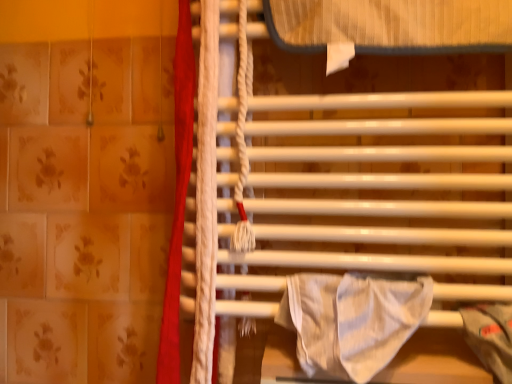
Question: Considering the relative sizes of red fabric curtain at left and white glossy towel rack at center in the image provided, is red fabric curtain at left smaller than white glossy towel rack at center?

Choices:
 (A) no
 (B) yes

Answer: (B)

Question: Can you confirm if red fabric curtain at left is shorter than white glossy towel rack at center?

Choices:
 (A) yes
 (B) no

Answer: (B)

Question: From a real-world perspective, is red fabric curtain at left physically above white glossy towel rack at center?

Choices:
 (A) no
 (B) yes

Answer: (A)

Question: Would you say red fabric curtain at left is a long distance from white glossy towel rack at center?

Choices:
 (A) yes
 (B) no

Answer: (B)

Question: From the image's perspective, is red fabric curtain at left over white glossy towel rack at center?

Choices:
 (A) yes
 (B) no

Answer: (B)

Question: Looking at the image, does white striped fabric at center seem bigger or smaller compared to red fabric curtain at left?

Choices:
 (A) big
 (B) small

Answer: (B)

Question: From the image's perspective, is white striped fabric at center above or below red fabric curtain at left?

Choices:
 (A) above
 (B) below

Answer: (B)

Question: Is white striped fabric at center in front of or behind red fabric curtain at left in the image?

Choices:
 (A) behind
 (B) front

Answer: (B)

Question: Is white striped fabric at center inside or outside of red fabric curtain at left?

Choices:
 (A) outside
 (B) inside

Answer: (A)

Question: From the image's perspective, relative to red fabric curtain at left, is white glossy towel rack at center above or below?

Choices:
 (A) above
 (B) below

Answer: (A)

Question: Considering the positions of white glossy towel rack at center and red fabric curtain at left in the image, is white glossy towel rack at center taller or shorter than red fabric curtain at left?

Choices:
 (A) tall
 (B) short

Answer: (B)

Question: Looking at the image, does white glossy towel rack at center seem bigger or smaller compared to red fabric curtain at left?

Choices:
 (A) small
 (B) big

Answer: (B)

Question: Considering their positions, is white glossy towel rack at center located in front of or behind red fabric curtain at left?

Choices:
 (A) front
 (B) behind

Answer: (A)

Question: Is red fabric curtain at left inside or outside of white striped fabric at center?

Choices:
 (A) outside
 (B) inside

Answer: (A)

Question: From a real-world perspective, is red fabric curtain at left positioned above or below white striped fabric at center?

Choices:
 (A) above
 (B) below

Answer: (A)